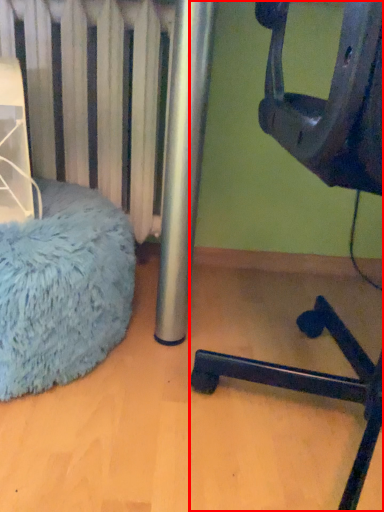
Question: Considering the relative positions of furniture (annotated by the red box) and bean bag chair in the image provided, where is furniture (annotated by the red box) located with respect to the staircase?

Choices:
 (A) right
 (B) left

Answer: (A)